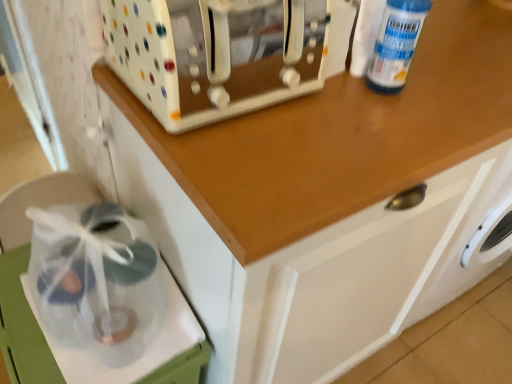
Describe the element at coordinates (22, 327) in the screenshot. I see `clear plastic bag at lower left` at that location.

Find the location of a particular element. clear plastic bottle at upper right is located at coordinates (396, 44).

Is clear plastic bag at lower left aimed at white glossy toaster at upper center?

No, clear plastic bag at lower left is not aimed at white glossy toaster at upper center.

Is clear plastic bag at lower left not close to white glossy toaster at upper center?

No, clear plastic bag at lower left is in close proximity to white glossy toaster at upper center.

Which is behind, point (141, 381) or point (254, 5)?

Point (254, 5)

In the image, there is a clear plastic bag at lower left. Where is `home appliance above it (from the image's perspective)`? The image size is (512, 384). home appliance above it (from the image's perspective) is located at coordinates (215, 54).

Based on the photo, which object is closer to the camera taking this photo, white glossy toaster at upper center or clear plastic bottle at upper right?

white glossy toaster at upper center is closer to the camera.

From a real-world perspective, is white glossy toaster at upper center under clear plastic bottle at upper right?

Indeed, from a real-world perspective, white glossy toaster at upper center is positioned beneath clear plastic bottle at upper right.

What's the angular difference between white glossy toaster at upper center and clear plastic bottle at upper right's facing directions?

The angular difference between white glossy toaster at upper center and clear plastic bottle at upper right is 2.05 degrees.

Considering the sizes of white glossy toaster at upper center and clear plastic bottle at upper right in the image, is white glossy toaster at upper center taller or shorter than clear plastic bottle at upper right?

Clearly, white glossy toaster at upper center is shorter compared to clear plastic bottle at upper right.

Consider the image. How many degrees apart are the facing directions of clear plastic bottle at upper right and white glossy toaster at upper center?

The facing directions of clear plastic bottle at upper right and white glossy toaster at upper center are 2.05 degrees apart.

Is clear plastic bottle at upper right closer to camera compared to white glossy toaster at upper center?

That is False.

Considering the relative sizes of clear plastic bottle at upper right and white glossy toaster at upper center in the image provided, is clear plastic bottle at upper right wider than white glossy toaster at upper center?

In fact, clear plastic bottle at upper right might be narrower than white glossy toaster at upper center.

What's the angular difference between white glossy toaster at upper center and clear plastic bag at lower left's facing directions?

The facing directions of white glossy toaster at upper center and clear plastic bag at lower left are 92.2 degrees apart.

Locate an element on the screen. This screenshot has height=384, width=512. cabinetry below the white glossy toaster at upper center (from a real-world perspective) is located at coordinates (22, 327).

Can clear plastic bag at lower left be found inside white glossy toaster at upper center?

That's incorrect, clear plastic bag at lower left is not inside white glossy toaster at upper center.

From a real-world perspective, which is physically below, white glossy toaster at upper center or clear plastic bag at lower left?

In real-world perspective, clear plastic bag at lower left is lower.

Does clear plastic bag at lower left appear on the right side of clear plastic bottle at upper right?

No, clear plastic bag at lower left is not to the right of clear plastic bottle at upper right.

The height and width of the screenshot is (384, 512). There is a clear plastic bag at lower left. Identify the location of bottle above it (from a real-world perspective). (396, 44).

Consider the image. From the image's perspective, which is below, clear plastic bag at lower left or clear plastic bottle at upper right?

clear plastic bag at lower left is shown below in the image.

From a real-world perspective, who is located higher, clear plastic bag at lower left or clear plastic bottle at upper right?

From a 3D spatial view, clear plastic bottle at upper right is above.

From a real-world perspective, is clear plastic bottle at upper right physically located above or below clear plastic bag at lower left?

Clearly, from a real-world perspective, clear plastic bottle at upper right is above clear plastic bag at lower left.

How different are the orientations of clear plastic bottle at upper right and clear plastic bag at lower left in degrees?

The angular difference between clear plastic bottle at upper right and clear plastic bag at lower left is 90.1 degrees.

Does clear plastic bottle at upper right have a greater width compared to clear plastic bag at lower left?

No.

In the scene shown: Would you consider clear plastic bottle at upper right to be distant from clear plastic bag at lower left?

They are positioned close to each other.

Where is `home appliance that is above the clear plastic bag at lower left (from a real-world perspective)`? The width and height of the screenshot is (512, 384). home appliance that is above the clear plastic bag at lower left (from a real-world perspective) is located at coordinates (215, 54).

I want to click on home appliance above the clear plastic bottle at upper right (from the image's perspective), so click(x=215, y=54).

Estimate the real-world distances between objects in this image. Which object is closer to white glossy toaster at upper center, clear plastic bag at lower left or clear plastic bottle at upper right?

clear plastic bottle at upper right is closer to white glossy toaster at upper center.

When comparing their distances from white glossy toaster at upper center, does clear plastic bottle at upper right or clear plastic bag at lower left seem closer?

The object closer to white glossy toaster at upper center is clear plastic bottle at upper right.

Considering their positions, is white glossy toaster at upper center positioned further to clear plastic bag at lower left than clear plastic bottle at upper right?

clear plastic bottle at upper right is further to clear plastic bag at lower left.

Based on their spatial positions, is clear plastic bag at lower left or white glossy toaster at upper center further from clear plastic bottle at upper right?

Based on the image, clear plastic bag at lower left appears to be further to clear plastic bottle at upper right.

Looking at the image, which one is located closer to clear plastic bottle at upper right, white glossy toaster at upper center or clear plastic bag at lower left?

Based on the image, white glossy toaster at upper center appears to be nearer to clear plastic bottle at upper right.

Which object lies nearer to the anchor point clear plastic bag at lower left, clear plastic bottle at upper right or white glossy toaster at upper center?

white glossy toaster at upper center is positioned closer to the anchor clear plastic bag at lower left.

Image resolution: width=512 pixels, height=384 pixels. Identify the location of bottle between white glossy toaster at upper center and clear plastic bag at lower left vertically. coord(396,44).